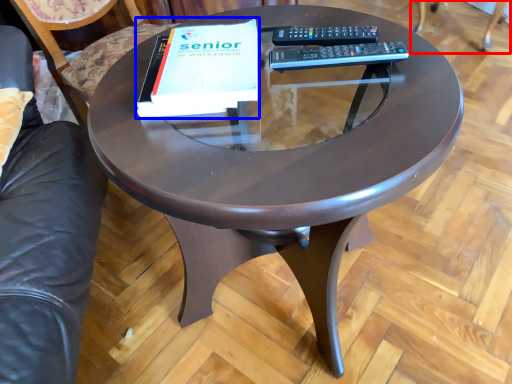
Question: Which point is closer to the camera, swivel chair (highlighted by a red box) or paperback book (highlighted by a blue box)?

Choices:
 (A) swivel chair
 (B) paperback book

Answer: (B)